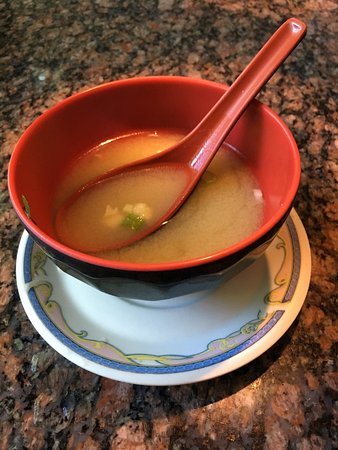
You are a GUI agent. You are given a task and a screenshot of the screen. Output one action in this format:
    pyautogui.click(x=<x>, y=<y>)
    Task: Click on the spoon
    
    Given the screenshot: What is the action you would take?
    pyautogui.click(x=236, y=106)